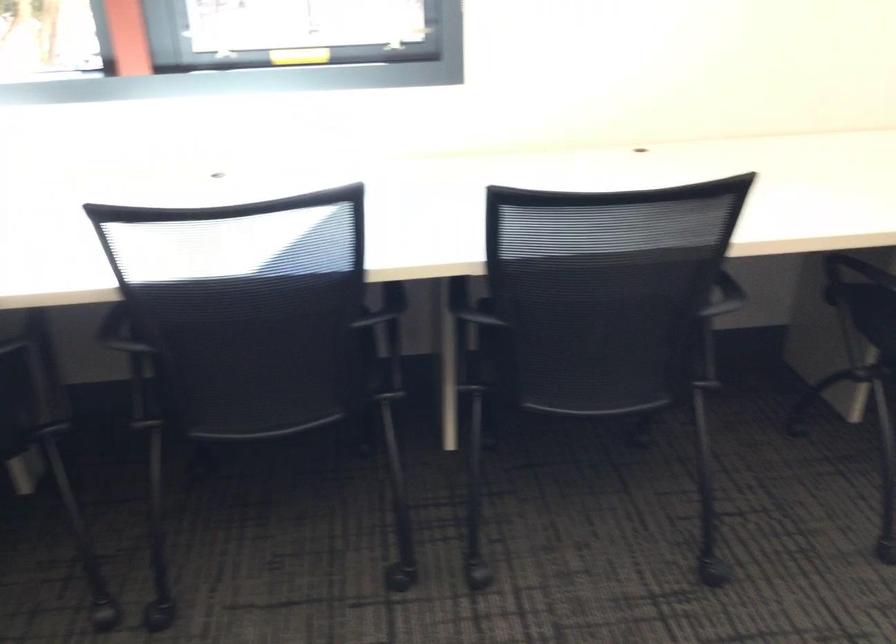
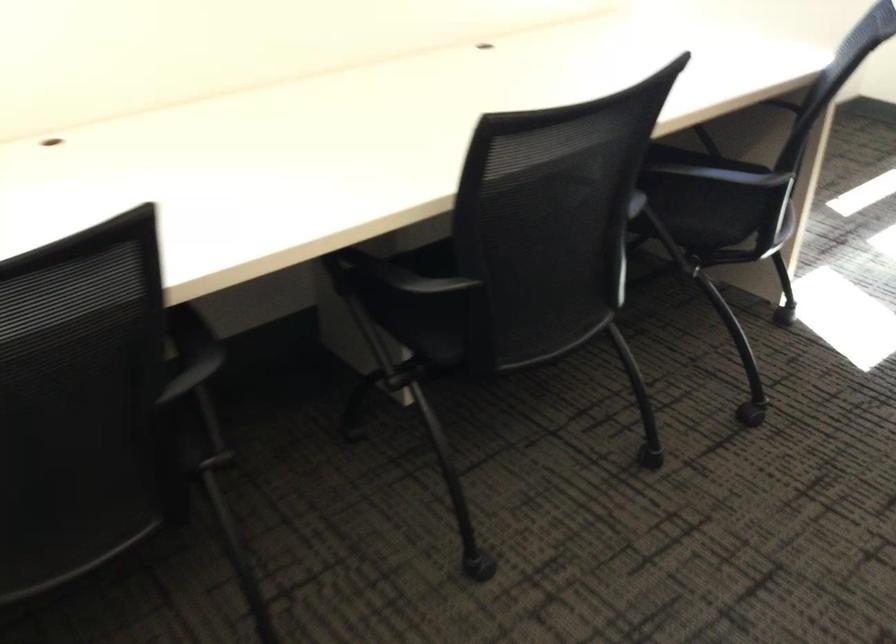
Question: The camera is either moving clockwise (left) or counter-clockwise (right) around the object. The first image is from the beginning of the video and the second image is from the end. Is the camera moving left or right when shooting the video?

Choices:
 (A) Left
 (B) Right

Answer: (A)